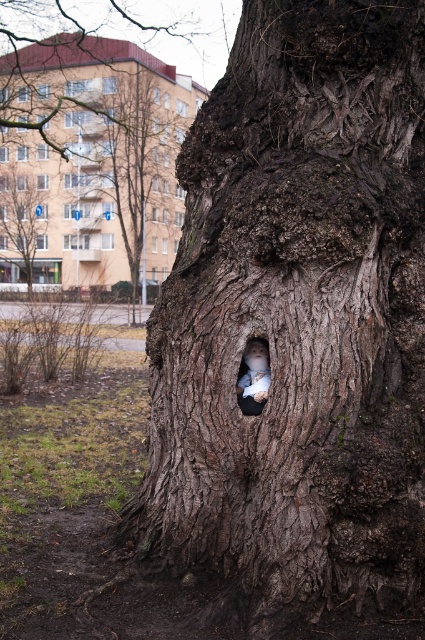
You are a painter standing in front of the tree trunk. You need to paint both the dark brown rough bark at center and the smooth bark tree at center. Which part of the tree should you paint first if you want to start from the lower part of the trunk?

You should paint the dark brown rough bark at center first because it is located below the smooth bark tree at center, so it is the lower part of the trunk.

You are standing at the base of the tree trunk and want to walk towards the residential building in the background. Which point, point (291, 404) or point (70, 244), is closer to your path?

Point (70, 244) is closer to your path because it is behind point (291, 404), which is in front of it.

Looking at this image, you are standing in front of the tree trunk and want to touch both the dark brown rough bark at center and the white fur face at center. Which one can you reach first without moving your position?

The dark brown rough bark at center is closer to the viewer than the white fur face at center, so you can reach the dark brown rough bark at center first without moving your position.